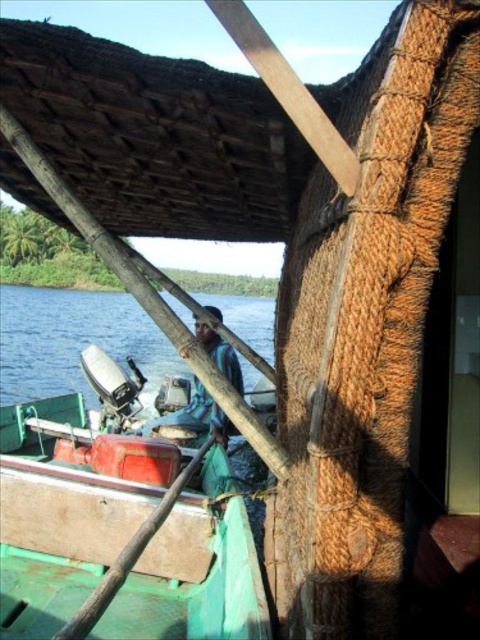
Question: Which point is farther from the camera taking this photo?

Choices:
 (A) (216, 355)
 (B) (59, 582)

Answer: (A)

Question: Which object is closer to the camera taking this photo?

Choices:
 (A) blue fabric shirt at center
 (B) blue water at lower left

Answer: (A)

Question: In this image, where is green matte boat at center located relative to blue water at lower left?

Choices:
 (A) left
 (B) right

Answer: (B)

Question: Does blue water at lower left have a greater width compared to blue fabric shirt at center?

Choices:
 (A) no
 (B) yes

Answer: (B)

Question: Which of the following is the farthest from the observer?

Choices:
 (A) blue water at lower left
 (B) blue fabric shirt at center
 (C) green matte boat at center

Answer: (A)

Question: Does green matte boat at center have a lesser width compared to blue fabric shirt at center?

Choices:
 (A) yes
 (B) no

Answer: (B)